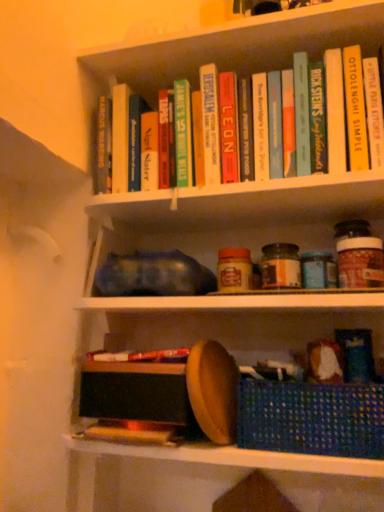
Question: From a real-world perspective, is hardcover book at center, acting as the first paperback book starting from the left, physically located above or below hardcover book at center?

Choices:
 (A) above
 (B) below

Answer: (A)

Question: In the image, is hardcover book at center, acting as the first paperback book starting from the left, positioned in front of or behind hardcover book at center?

Choices:
 (A) behind
 (B) front

Answer: (A)

Question: Considering the real-world distances, which object is closest to the hardcover book at center, which is the fourth paperback book in right-to-left order?

Choices:
 (A) hardcover book at upper right, which is the fourth paperback book in left-to-right order
 (B) brown matte glass jar at center-right
 (C) blue woven basket at lower right
 (D) hardcover book at upper center, the second paperback book viewed from the left
 (E) hardcover book at center

Answer: (D)

Question: Which of these objects is positioned farthest from the hardcover book at upper center, the third paperback book viewed from the right?

Choices:
 (A) hardcover book at center, acting as the first paperback book starting from the left
 (B) hardcover book at upper center, the 3th paperback book viewed from the left
 (C) blue woven basket at lower right
 (D) hardcover book at center
 (E) hardcover book at upper right, which appears as the 1th paperback book when viewed from the right

Answer: (C)